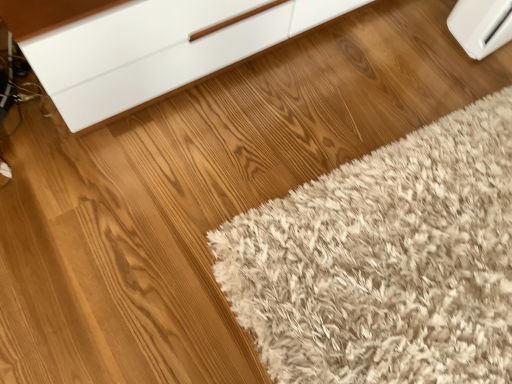
Measure the distance between white shaggy rug at lower right and camera.

white shaggy rug at lower right is 1.10 meters from camera.

What do you see at coordinates (385, 262) in the screenshot? I see `white shaggy rug at lower right` at bounding box center [385, 262].

Locate an element on the screen. white shaggy rug at lower right is located at coordinates (385, 262).

The width and height of the screenshot is (512, 384). What are the coordinates of `white shaggy rug at lower right` in the screenshot? It's located at (385, 262).